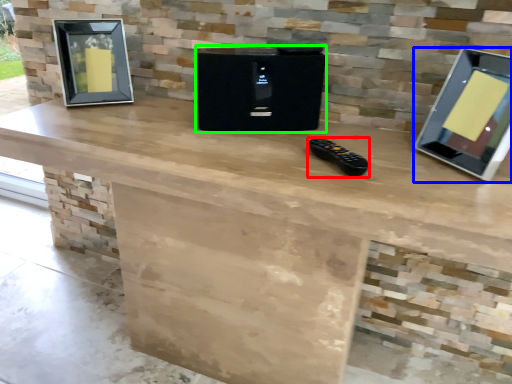
Question: Which is farther away from game controller (highlighted by a red box)? computer monitor (highlighted by a blue box) or appliance (highlighted by a green box)?

Choices:
 (A) computer monitor
 (B) appliance

Answer: (A)